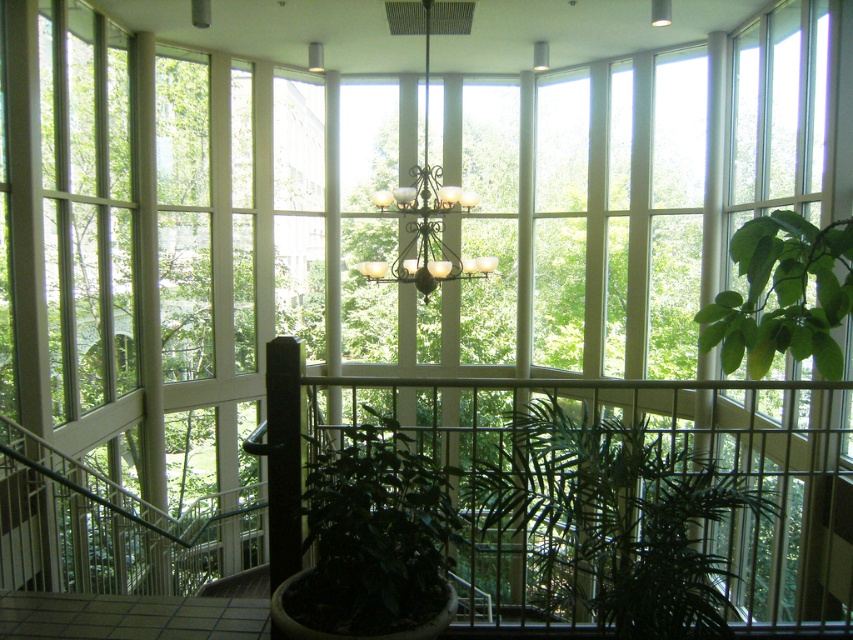
You are standing on the indoor balcony and want to take a photo of both the green leafy plant at center and the matte glass chandelier at center. Which object should you focus on first if you want to capture both in the same frame without moving your camera?

The green leafy plant at center is bigger than the matte glass chandelier at center, so you should focus on the matte glass chandelier at center first to ensure both fit in the frame.

You are standing on the indoor balcony and want to place a new potted plant exactly at the center of the balcony. The existing green matte plant at center is already placed at point (373, 536). Is there enough space to place another potted plant at the exact center without overlapping?

The green matte plant at center is already placed at point (373, 536), so placing another potted plant at the exact center would cause an overlap. Therefore, there is not enough space.

You are standing on the indoor balcony and want to place a decorative item exactly at the center of the balcony. There is already a green matte plant at center. Can you place the item there without moving the plant?

The green matte plant at center is located at point [373,536], which is the center of the balcony. Therefore, you cannot place the decorative item there without moving the plant.